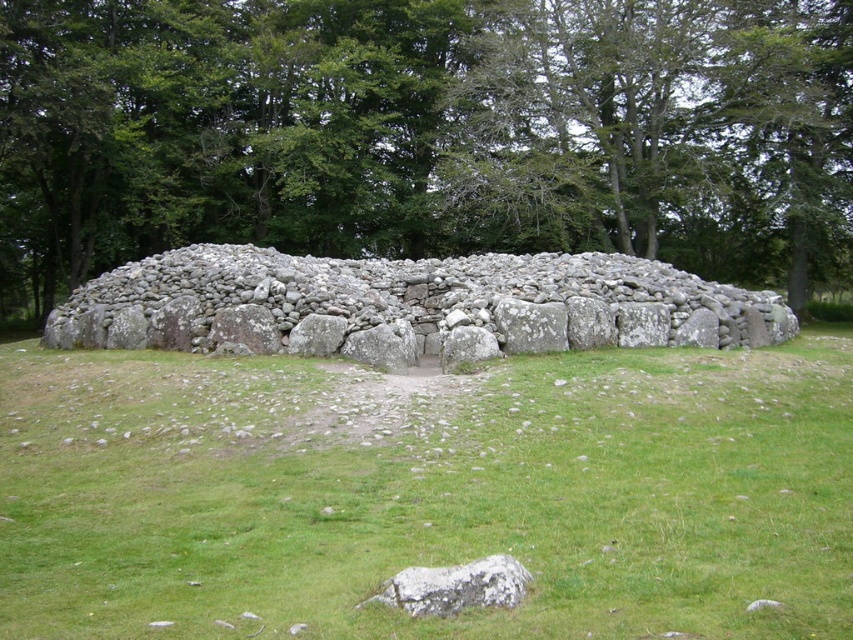
Is green grass at center bigger than gray rough rock at lower center?

Yes.

Is green grass at center taller than gray rough rock at lower center?

Indeed, green grass at center has a greater height compared to gray rough rock at lower center.

Is point (22, 362) less distant than point (453, 566)?

No, (22, 362) is behind (453, 566).

This screenshot has width=853, height=640. I want to click on green grass at center, so click(426, 492).

Between green leafy tree at upper center and gray stone wall at center, which one is positioned lower?

Positioned lower is gray stone wall at center.

Is green leafy tree at upper center positioned in front of gray stone wall at center?

No.

Measure the distance between green leafy tree at upper center and camera.

The distance of green leafy tree at upper center from camera is 121.28 feet.

Where is `green leafy tree at upper center`? green leafy tree at upper center is located at coordinates (425, 132).

Which is more to the left, green grass at center or gray stone wall at center?

From the viewer's perspective, gray stone wall at center appears more on the left side.

Is the position of green grass at center more distant than that of gray stone wall at center?

No, it is not.

You are a GUI agent. You are given a task and a screenshot of the screen. Output one action in this format:
    pyautogui.click(x=<x>, y=<y>)
    Task: Click on the green grass at center
    
    Given the screenshot: What is the action you would take?
    pyautogui.click(x=426, y=492)

Find the location of a particular element. green grass at center is located at coordinates (426, 492).